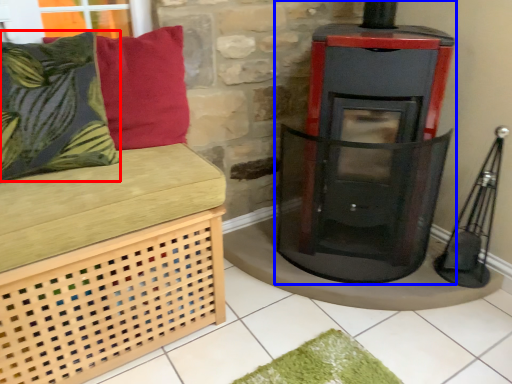
Question: Which object is further to the camera taking this photo, pillow (highlighted by a red box) or wood burning stove (highlighted by a blue box)?

Choices:
 (A) pillow
 (B) wood burning stove

Answer: (B)